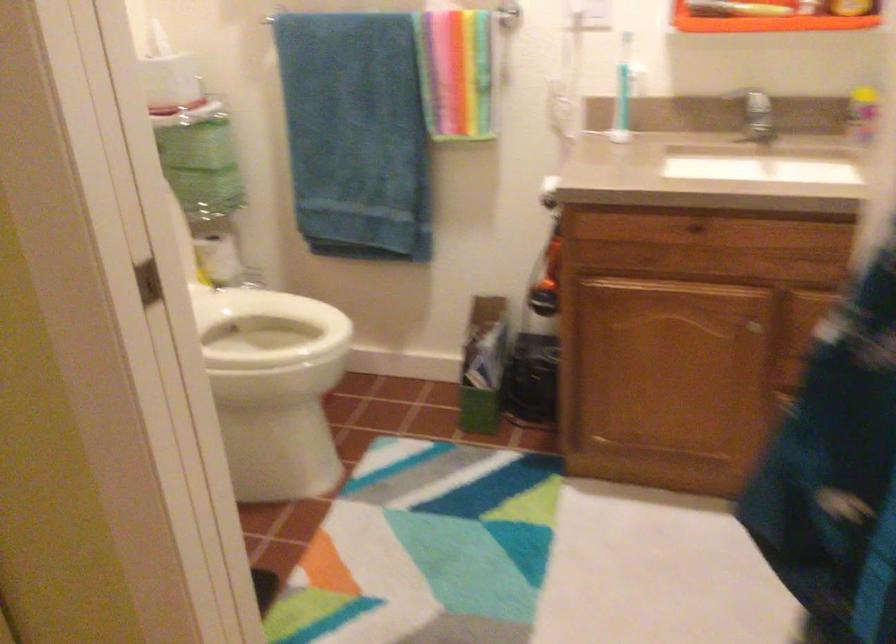
Where would you lift the silver faucet handle? Please return your answer as a coordinate pair (x, y).

(755, 114)